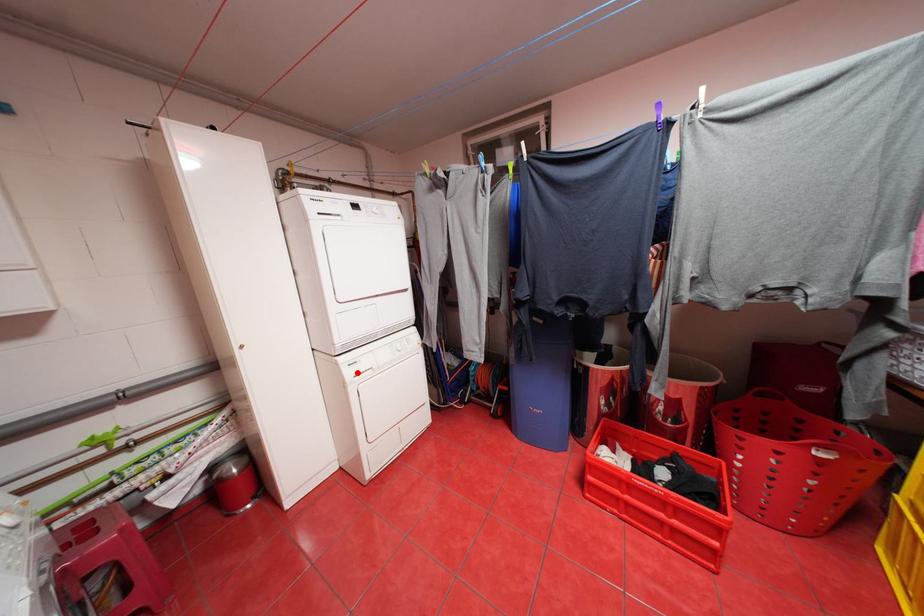
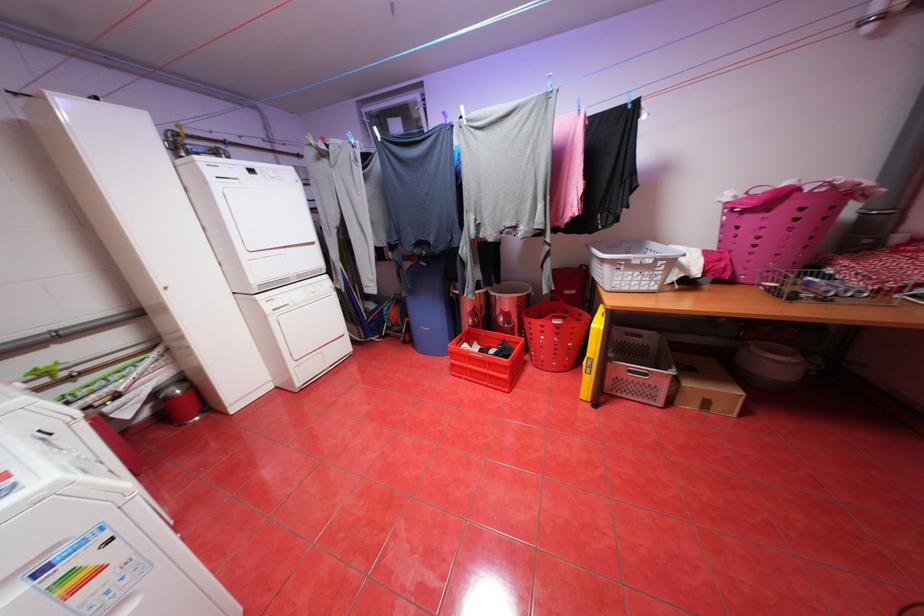
In the second image, find the point that corresponds to the highlighted location in the first image.

(275, 307)